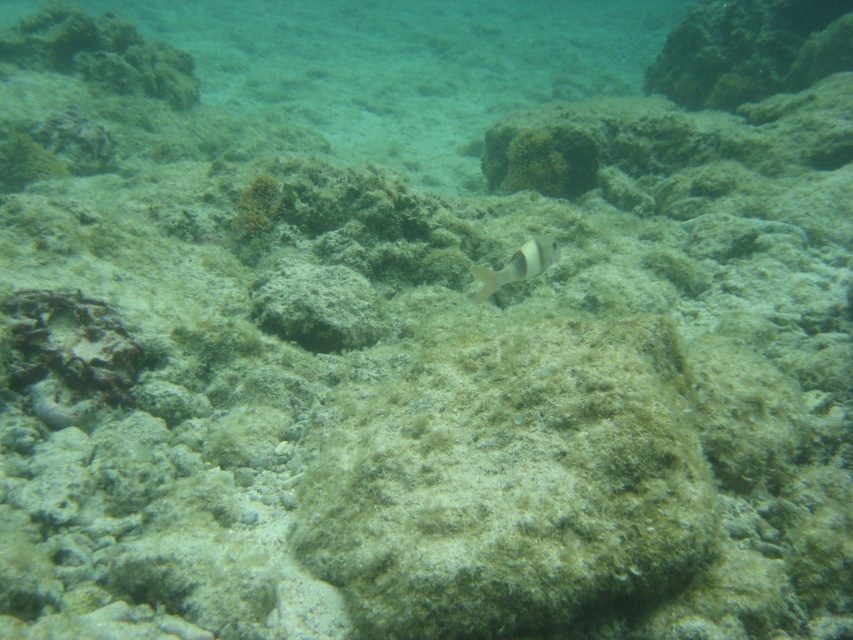
Can you confirm if smooth gray rock at center is wider than white matte fish at center?

Indeed, smooth gray rock at center has a greater width compared to white matte fish at center.

Can you confirm if smooth gray rock at center is positioned below white matte fish at center?

Correct, smooth gray rock at center is located below white matte fish at center.

Which is behind, point (306, 289) or point (480, 275)?

The point (306, 289) is more distant.

Find the location of a particular element. Image resolution: width=853 pixels, height=640 pixels. smooth gray rock at center is located at coordinates (317, 305).